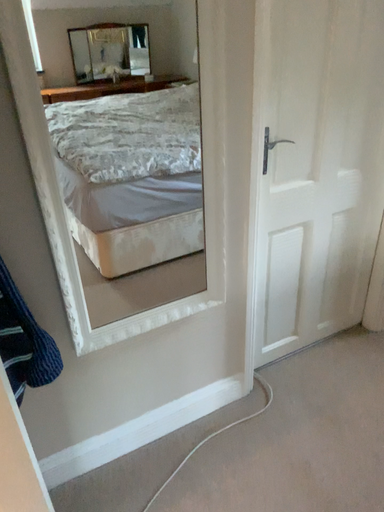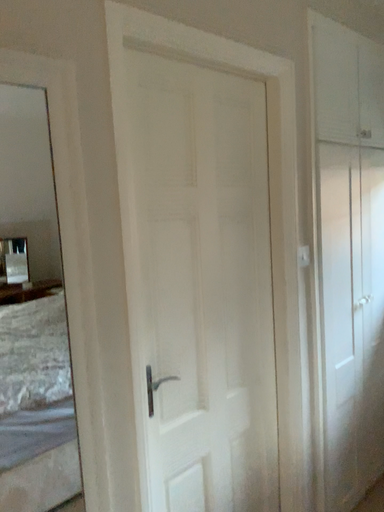
Question: Which way did the camera rotate in the video?

Choices:
 (A) rotated upward
 (B) rotated downward

Answer: (A)